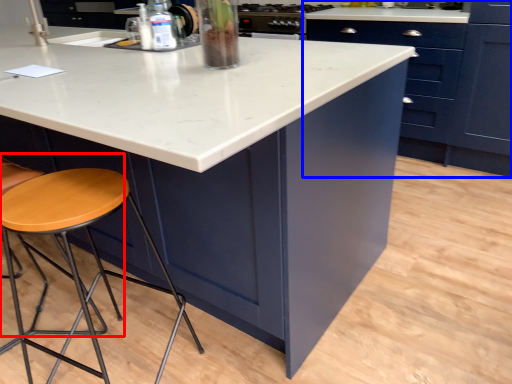
Question: Among these objects, which one is farthest to the camera, chair (highlighted by a red box) or cabinetry (highlighted by a blue box)?

Choices:
 (A) chair
 (B) cabinetry

Answer: (B)